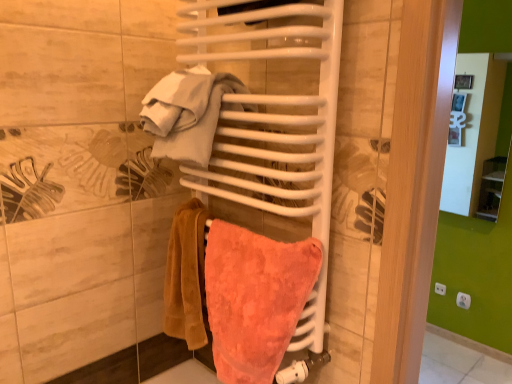
Describe the element at coordinates (187, 113) in the screenshot. I see `white cotton towel at upper center` at that location.

Where is `white cotton towel at upper center`? white cotton towel at upper center is located at coordinates (187, 113).

What is the approximate width of white cotton towel at upper center?

It is 10.88 inches.

Describe the element at coordinates (255, 299) in the screenshot. The width and height of the screenshot is (512, 384). I see `coral terry towel at center` at that location.

Measure the distance between point (297, 249) and camera.

The depth of point (297, 249) is 1.01 meters.

The width and height of the screenshot is (512, 384). What are the coordinates of `coral terry towel at center` in the screenshot? It's located at (255, 299).

Locate an element on the screen. white cotton towel at upper center is located at coordinates (187, 113).

Considering the positions of objects coral terry towel at center and white cotton towel at upper center in the image provided, who is more to the left, coral terry towel at center or white cotton towel at upper center?

white cotton towel at upper center is more to the left.

Is coral terry towel at center further to camera compared to white cotton towel at upper center?

No, coral terry towel at center is closer to the viewer.

Considering the positions of points (224, 316) and (165, 118), is point (224, 316) closer to camera compared to point (165, 118)?

No.

From the image's perspective, which object appears higher, coral terry towel at center or white cotton towel at upper center?

Answer: white cotton towel at upper center appears higher in the image.

From a real-world perspective, which object rests below the other?

From a 3D spatial view, coral terry towel at center is below.

Considering the sizes of coral terry towel at center and white cotton towel at upper center in the image, is coral terry towel at center wider or thinner than white cotton towel at upper center?

Considering their sizes, coral terry towel at center looks slimmer than white cotton towel at upper center.

Who is shorter, coral terry towel at center or white cotton towel at upper center?

With less height is white cotton towel at upper center.

Considering the relative sizes of coral terry towel at center and white cotton towel at upper center in the image provided, is coral terry towel at center smaller than white cotton towel at upper center?

No, coral terry towel at center is not smaller than white cotton towel at upper center.

Which is correct: coral terry towel at center is inside white cotton towel at upper center, or outside of it?

coral terry towel at center is not enclosed by white cotton towel at upper center.

Can you see coral terry towel at center touching white cotton towel at upper center?

No, coral terry towel at center is not beside white cotton towel at upper center.

Does coral terry towel at center turn towards white cotton towel at upper center?

No.

Identify the location of towel on the right of white cotton towel at upper center. The image size is (512, 384). (255, 299).

Considering the relative positions of white cotton towel at upper center and coral terry towel at center in the image provided, is white cotton towel at upper center to the left of coral terry towel at center from the viewer's perspective?

Yes.

Considering their positions, is white cotton towel at upper center located in front of or behind coral terry towel at center?

In the image, white cotton towel at upper center appears behind coral terry towel at center.

Which point is more distant from viewer, (195, 147) or (213, 330)?

Point (213, 330)

From the image's perspective, would you say white cotton towel at upper center is shown under coral terry towel at center?

No.

From a real-world perspective, which is physically below, white cotton towel at upper center or coral terry towel at center?

In real-world perspective, coral terry towel at center is lower.

Which of these two, white cotton towel at upper center or coral terry towel at center, is thinner?

With smaller width is coral terry towel at center.

Is white cotton towel at upper center shorter than coral terry towel at center?

Indeed, white cotton towel at upper center has a lesser height compared to coral terry towel at center.

Is white cotton towel at upper center smaller than coral terry towel at center?

Indeed, white cotton towel at upper center has a smaller size compared to coral terry towel at center.

Do you think white cotton towel at upper center is within coral terry towel at center, or outside of it?

white cotton towel at upper center is not enclosed by coral terry towel at center.

Is white cotton towel at upper center far away from coral terry towel at center?

white cotton towel at upper center is actually quite close to coral terry towel at center.

Is white cotton towel at upper center oriented away from coral terry towel at center?

That's not correct — white cotton towel at upper center is not looking away from coral terry towel at center.

What's the angular difference between white cotton towel at upper center and coral terry towel at center's facing directions?

The angular difference between white cotton towel at upper center and coral terry towel at center is 0.000145 degrees.

This screenshot has height=384, width=512. In the image, there is a white cotton towel at upper center. In order to click on towel below it (from the image's perspective) in this screenshot , I will do `click(255, 299)`.

The image size is (512, 384). I want to click on towel below the white cotton towel at upper center (from the image's perspective), so click(255, 299).

Find the location of a particular element. Image resolution: width=512 pixels, height=384 pixels. beach towel lying on the left of coral terry towel at center is located at coordinates (187, 113).